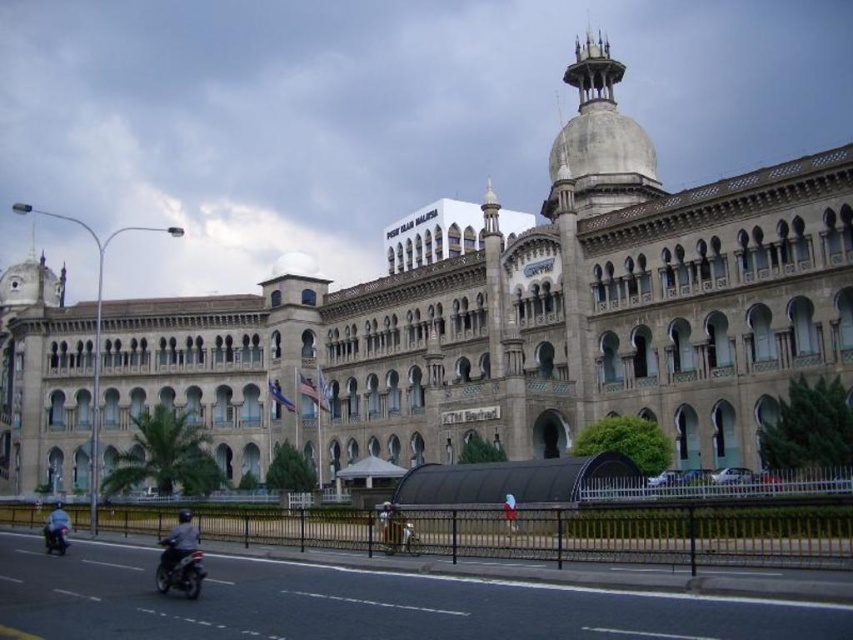
You are a pedestrian standing on the walkway near the historic building. You see a black matte motorbike at lower left and a blue fabric helmet at lower left. Which object is closer to the road?

The black matte motorbike at lower left is closer to the road because it is positioned over the blue fabric helmet at lower left, which is further away from the road.

You are a pedestrian standing on the walkway near the gray matte jacket on the left. You want to cross the road to reach the black matte motorbike at lower left. Which direction should you walk to get there?

You should walk to your right because the black matte motorbike at lower left is located to the right of the gray matte jacket on the left.